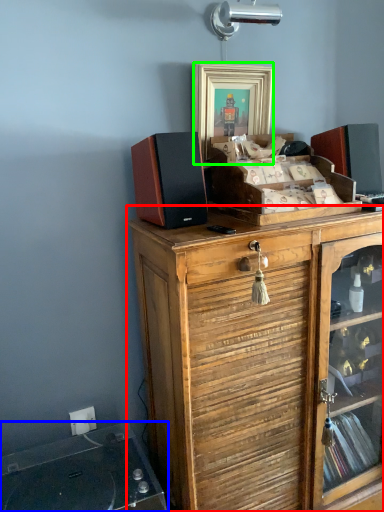
Question: Considering the real-world distances, which object is farthest from cabinetry (highlighted by a red box)? wide (highlighted by a blue box) or picture frame (highlighted by a green box)?

Choices:
 (A) wide
 (B) picture frame

Answer: (B)